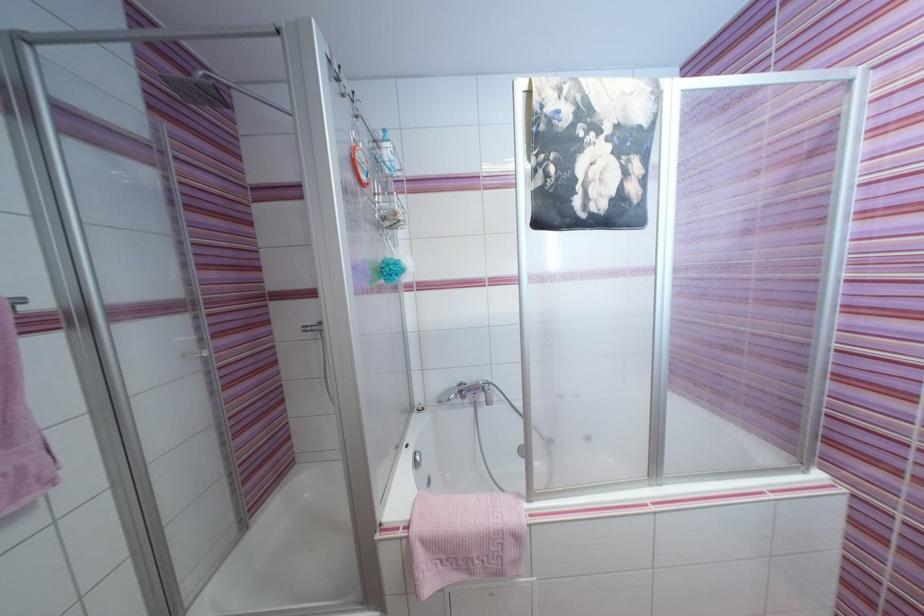
Find the location of a particular element. The height and width of the screenshot is (616, 924). blue mesh sponge is located at coordinates (391, 270).